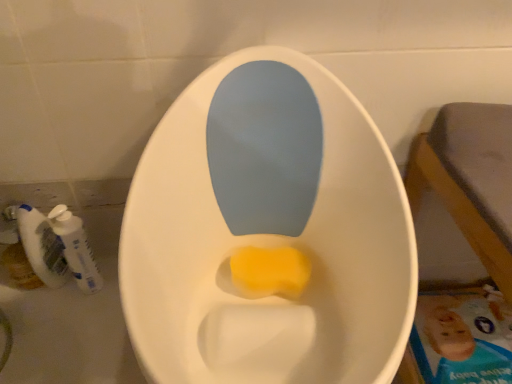
Question: Is yellow sponge at center not within white plastic mouthwash at lower left, which is counted as the first mouthwash, starting from the left?

Choices:
 (A) no
 (B) yes

Answer: (B)

Question: Can you confirm if yellow sponge at center is bigger than white plastic mouthwash at lower left, which appears as the second mouthwash when viewed from the right?

Choices:
 (A) yes
 (B) no

Answer: (A)

Question: Is yellow sponge at center turned away from white plastic mouthwash at lower left, which is counted as the first mouthwash, starting from the left?

Choices:
 (A) no
 (B) yes

Answer: (A)

Question: Can you confirm if yellow sponge at center is taller than white plastic mouthwash at lower left, which is counted as the first mouthwash, starting from the left?

Choices:
 (A) yes
 (B) no

Answer: (B)

Question: Does yellow sponge at center have a lesser height compared to white plastic mouthwash at lower left, which is counted as the first mouthwash, starting from the left?

Choices:
 (A) yes
 (B) no

Answer: (A)

Question: Could you tell me if yellow sponge at center is facing white plastic mouthwash at lower left, which is counted as the first mouthwash, starting from the left?

Choices:
 (A) yes
 (B) no

Answer: (B)

Question: Is white plastic mouthwash at left, which is counted as the first mouthwash, starting from the right, closer to camera compared to yellow sponge at center?

Choices:
 (A) yes
 (B) no

Answer: (B)

Question: From a real-world perspective, is white plastic mouthwash at left, the 2th mouthwash when ordered from left to right, over yellow sponge at center?

Choices:
 (A) yes
 (B) no

Answer: (B)

Question: Does white plastic mouthwash at left, the 2th mouthwash when ordered from left to right, touch yellow sponge at center?

Choices:
 (A) yes
 (B) no

Answer: (B)

Question: From the image's perspective, is white plastic mouthwash at left, which is counted as the first mouthwash, starting from the right, below yellow sponge at center?

Choices:
 (A) no
 (B) yes

Answer: (A)

Question: Is yellow sponge at center located within white plastic mouthwash at left, the 2th mouthwash when ordered from left to right?

Choices:
 (A) yes
 (B) no

Answer: (B)

Question: From the image's perspective, is white plastic mouthwash at left, the 2th mouthwash when ordered from left to right, on top of yellow sponge at center?

Choices:
 (A) yes
 (B) no

Answer: (A)

Question: Does white plastic mouthwash at lower left, which appears as the second mouthwash when viewed from the right, appear on the left side of white plastic mouthwash at left, which is counted as the first mouthwash, starting from the right?

Choices:
 (A) no
 (B) yes

Answer: (B)